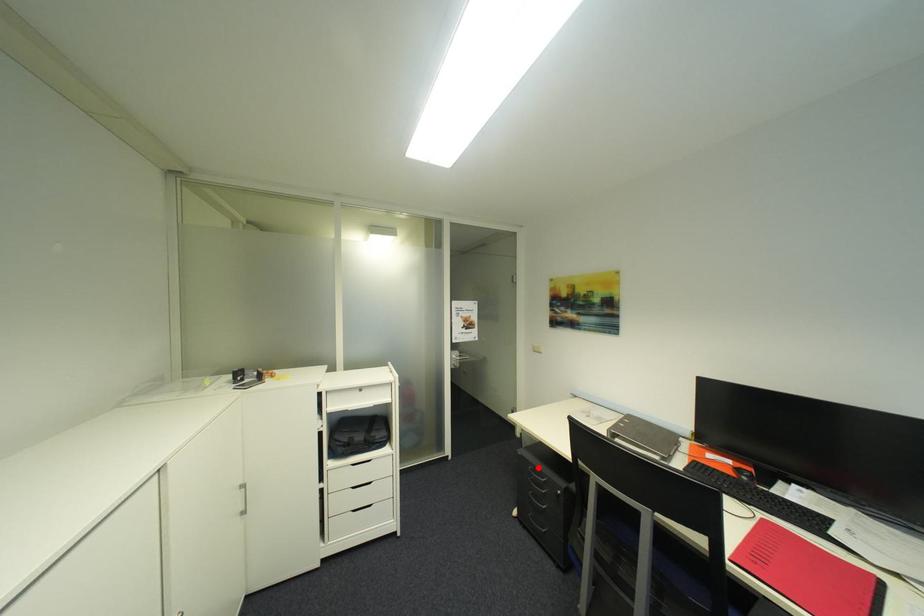
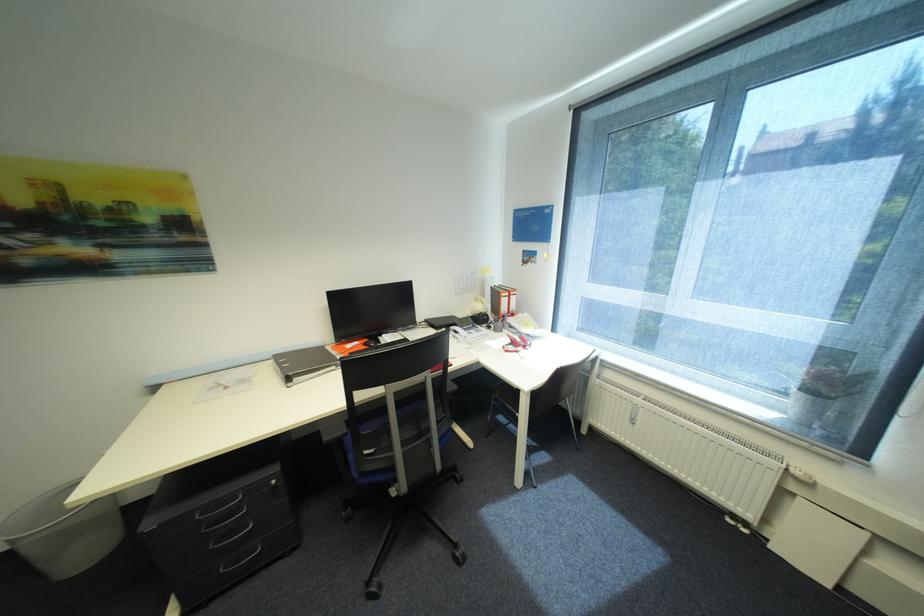
Question: I am providing you with two images of the same scene from different viewpoints. In image1, a red point is highlighted. Considering the same 3D point in image2, which of the following is correct?

Choices:
 (A) It is closer
 (B) It is farther

Answer: (B)